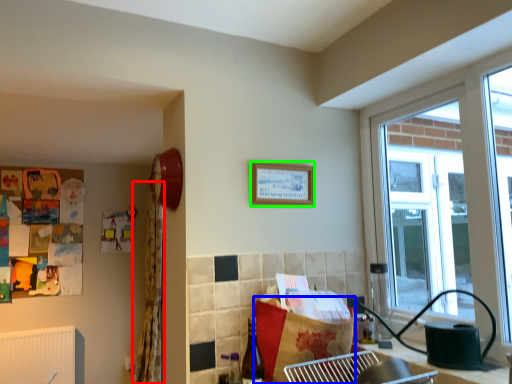
Question: Which is farther away from curtain (highlighted by a red box)? cardboard box (highlighted by a blue box) or picture frame (highlighted by a green box)?

Choices:
 (A) cardboard box
 (B) picture frame

Answer: (A)